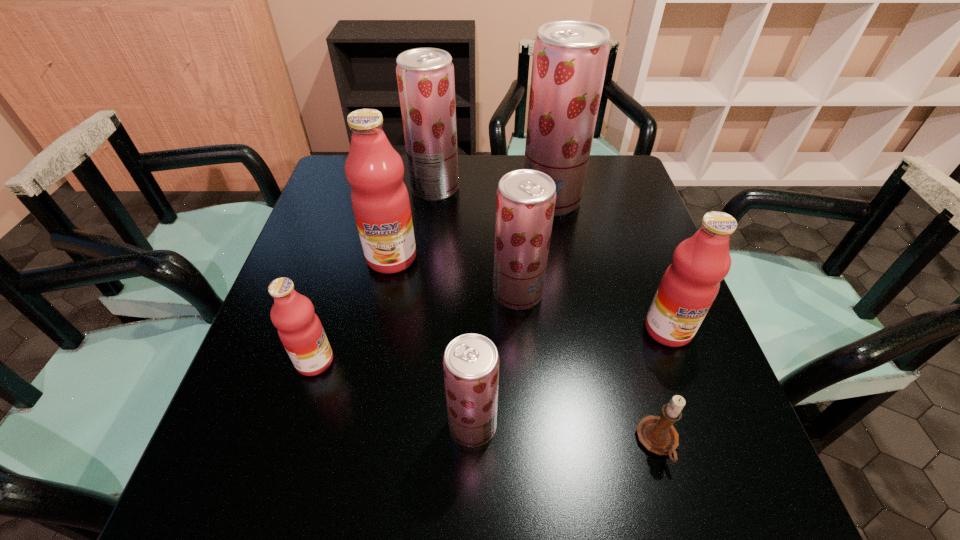
Locate an element on the screen. The height and width of the screenshot is (540, 960). vacant region at the near left corner of the desktop is located at coordinates (226, 499).

You are a GUI agent. You are given a task and a screenshot of the screen. Output one action in this format:
    pyautogui.click(x=<x>, y=<y>)
    Task: Click on the vacant space in between the smallest strawberry fruit juice and the smallest pink fruit juice
    This screenshot has width=960, height=540.
    Given the screenshot: What is the action you would take?
    pyautogui.click(x=394, y=394)

This screenshot has width=960, height=540. In order to click on empty space that is in between the second smallest strawberry fruit juice and the biggest pink fruit juice in this screenshot , I will do `click(455, 275)`.

Identify the location of vacant region between the shortest object and the third farthest strawberry fruit juice. The width and height of the screenshot is (960, 540). (588, 368).

Identify the location of vacant area that lies between the shortest object and the leftmost strawberry fruit juice. Image resolution: width=960 pixels, height=540 pixels. (546, 315).

Where is `empty location between the second smallest strawberry fruit juice and the leftmost pink fruit juice`? The width and height of the screenshot is (960, 540). empty location between the second smallest strawberry fruit juice and the leftmost pink fruit juice is located at coordinates click(x=417, y=327).

Identify the location of free space between the nearest strawberry fruit juice and the rightmost fruit juice. The width and height of the screenshot is (960, 540). (570, 377).

Identify the location of free space that is in between the second pink fruit juice from right to left and the leftmost fruit juice. The width and height of the screenshot is (960, 540). (353, 309).

At what (x,y) coordinates should I click in order to perform the action: click on unoccupied area between the second smallest strawberry fruit juice and the second pink fruit juice from left to right. Please return your answer as a coordinate pair (x, y). The height and width of the screenshot is (540, 960). Looking at the image, I should click on (455, 275).

This screenshot has height=540, width=960. Find the location of `empty space that is in between the smallest strawberry fruit juice and the second biggest strawberry fruit juice`. empty space that is in between the smallest strawberry fruit juice and the second biggest strawberry fruit juice is located at coordinates (454, 307).